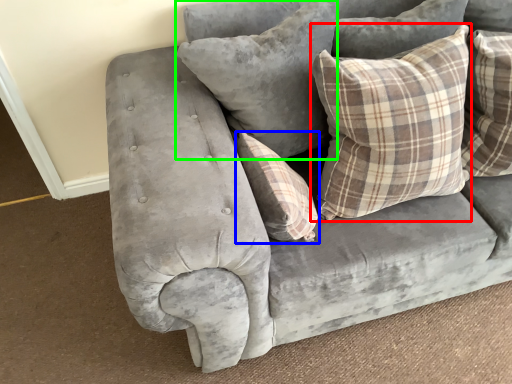
Question: Based on their relative distances, which object is farther from pillow (highlighted by a red box)? Choose from pillow (highlighted by a blue box) and pillow (highlighted by a green box).

Choices:
 (A) pillow
 (B) pillow

Answer: (A)